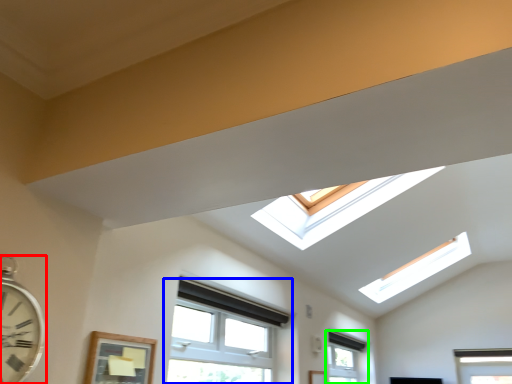
Question: Considering the real-world distances, which object is closest to clock (highlighted by a red box)? window (highlighted by a blue box) or window (highlighted by a green box).

Choices:
 (A) window
 (B) window

Answer: (A)